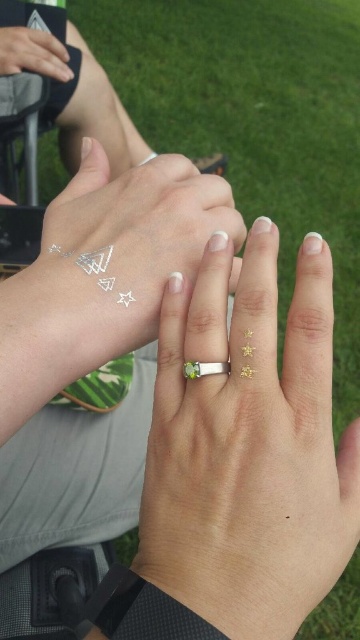
You are a jewelry designer observing the hands in the image. You need to decide which object is taller between the silver metallic temporary tattoo at upper left and the green gemstone ring at center. Based on the scene, which one is taller?

The silver metallic temporary tattoo at upper left is much taller as green gemstone ring at center.

You are holding a 12 inch ruler and want to measure the distance from your camera to the point at coordinates point (198, 349). Can you reach it with your ruler?

The point point (198, 349) is 13.53 inches from the camera, so the ruler is 12 inches long and cannot reach it.